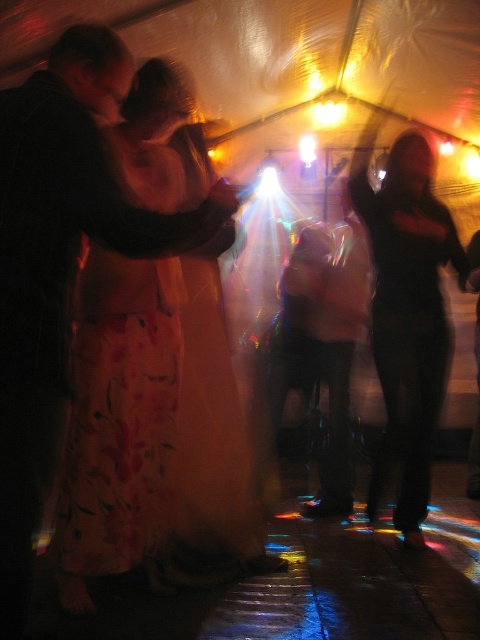
Is floral silk dress at center wider than black matte dress at center?

No, floral silk dress at center is not wider than black matte dress at center.

Can you confirm if floral silk dress at center is positioned to the left of black matte dress at center?

Correct, you'll find floral silk dress at center to the left of black matte dress at center.

Find the location of a particular element. The height and width of the screenshot is (640, 480). floral silk dress at center is located at coordinates (120, 413).

I want to click on floral silk dress at center, so (x=120, y=413).

Is point (122, 88) farther from viewer compared to point (136, 508)?

That is False.

Is matte black jacket at left positioned before floral silk dress at center?

Yes, matte black jacket at left is in front of floral silk dress at center.

What are the coordinates of `matte black jacket at left` in the screenshot? It's located at (60, 260).

Which is more to the right, matte black jacket at left or black matte dress at center?

black matte dress at center is more to the right.

Which of these two, matte black jacket at left or black matte dress at center, stands shorter?

matte black jacket at left

What do you see at coordinates (60, 260) in the screenshot? This screenshot has height=640, width=480. I see `matte black jacket at left` at bounding box center [60, 260].

Identify the location of matte black jacket at left. (60, 260).